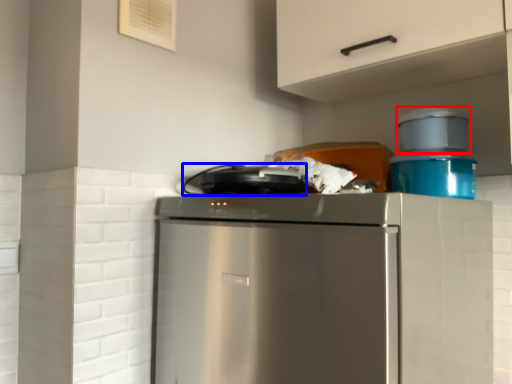
Question: Which of the following is the farthest to the observer, appliance (highlighted by a red box) or appliance (highlighted by a blue box)?

Choices:
 (A) appliance
 (B) appliance

Answer: (A)